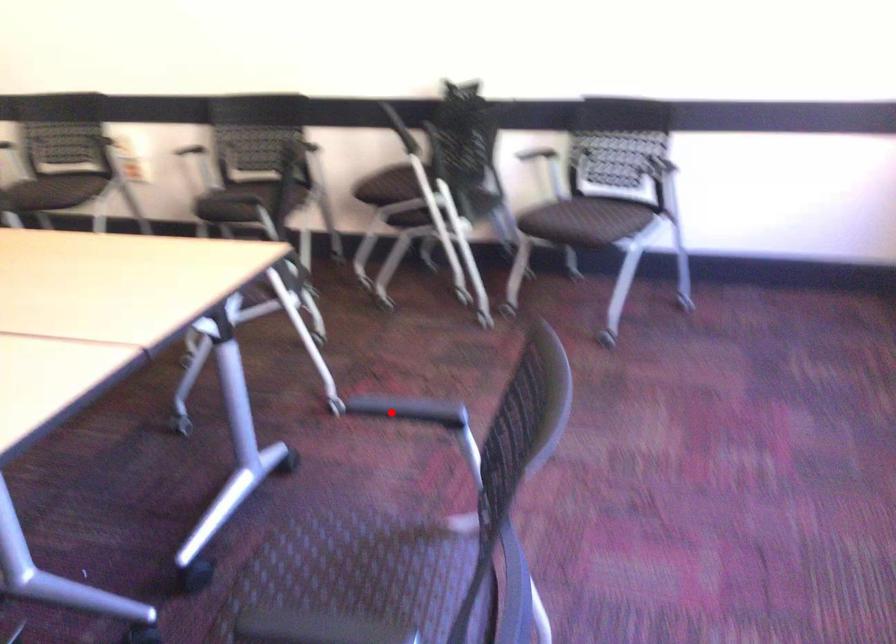
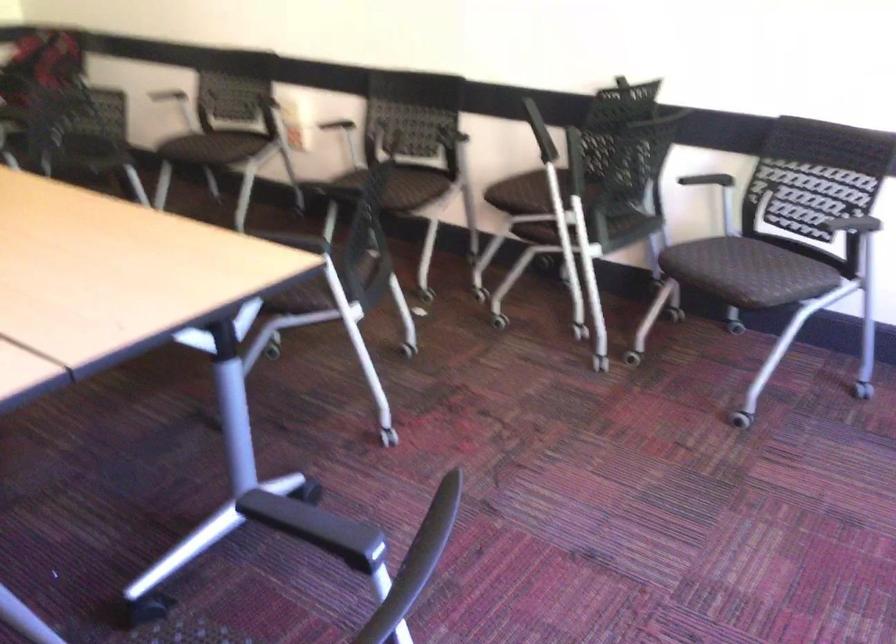
Question: A red point is marked in image1. In image2, is the corresponding 3D point closer to the camera or farther? Reply with the corresponding letter.

Choices:
 (A) The corresponding 3D point is closer.
 (B) The corresponding 3D point is farther.

Answer: (A)